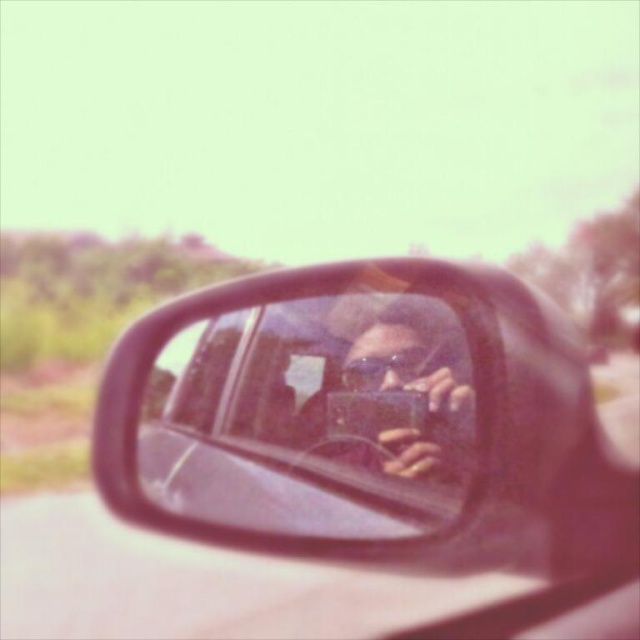
Question: Does shiny black mirror at center have a larger size compared to matte black camera at center?

Choices:
 (A) yes
 (B) no

Answer: (A)

Question: Which point is closer to the camera taking this photo?

Choices:
 (A) (305, 300)
 (B) (371, 408)

Answer: (B)

Question: Does shiny black mirror at center have a larger size compared to matte black camera at center?

Choices:
 (A) yes
 (B) no

Answer: (A)

Question: Does shiny black mirror at center have a lesser width compared to matte black camera at center?

Choices:
 (A) yes
 (B) no

Answer: (B)